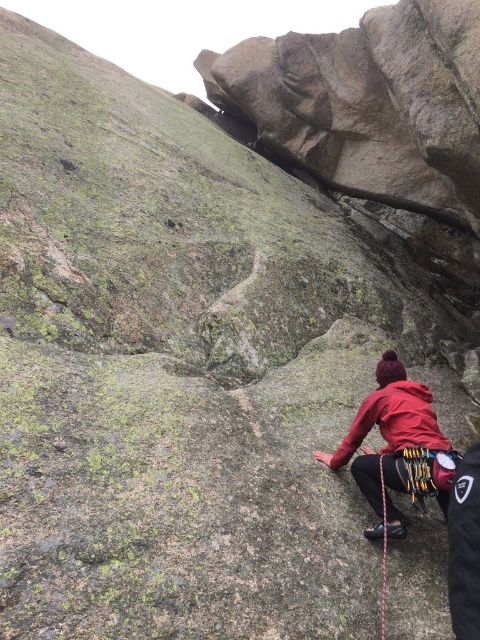
Looking at this image, you are a rock climber preparing to ascend the rock face. You notice two jackets at the lower right of your view. Which jacket is closer to you, the red fleece jacket at lower right or the red matte jacket at lower right?

The red fleece jacket at lower right is closer to you because it is positioned under the red matte jacket at lower right.

You are a rock climber trying to reach the top of the rock face. You notice a red matte jacket at lower right. Is the red matte jacket at lower right located above or below the point at coordinate (394, 420)?

The red matte jacket at lower right is located at the point at coordinate (394, 420).

You are a rock climber who has just reached a ledge and need to secure your gear. You see a red fleece jacket at lower right and a black nylon rope at lower right. Which item is taller and could potentially be used to hang a carabiner?

The red fleece jacket at lower right is much taller than the black nylon rope at lower right, so it could potentially be used to hang a carabiner.